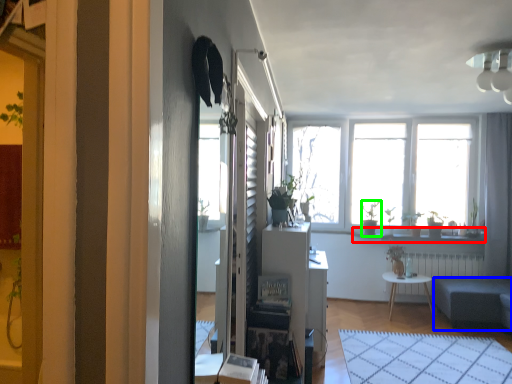
Question: Which object is the closest to the window sill (highlighted by a red box)? Choose among these: studio couch (highlighted by a blue box) or houseplant (highlighted by a green box).

Choices:
 (A) studio couch
 (B) houseplant

Answer: (B)